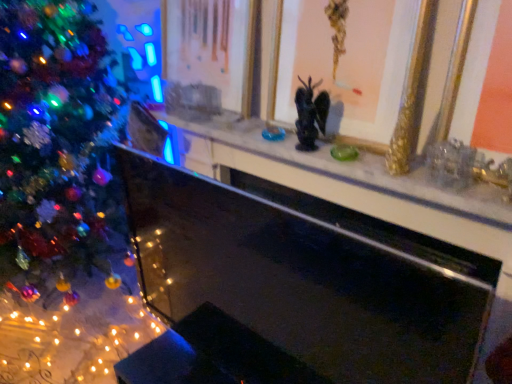
Question: Which direction should I rotate to look at gold/golden picture frame at upper center, the second picture frame viewed from the left, — up or down?

Choices:
 (A) down
 (B) up

Answer: (B)

Question: Is marble mantel at center not close to black glass fireplace at center?

Choices:
 (A) yes
 (B) no

Answer: (B)

Question: Does marble mantel at center have a greater height compared to black glass fireplace at center?

Choices:
 (A) yes
 (B) no

Answer: (B)

Question: From a real-world perspective, is marble mantel at center under black glass fireplace at center?

Choices:
 (A) no
 (B) yes

Answer: (A)

Question: Is black glass fireplace at center inside marble mantel at center?

Choices:
 (A) no
 (B) yes

Answer: (A)

Question: Can you see marble mantel at center touching black glass fireplace at center?

Choices:
 (A) yes
 (B) no

Answer: (B)

Question: Does marble mantel at center have a lesser width compared to black glass fireplace at center?

Choices:
 (A) no
 (B) yes

Answer: (A)

Question: Is gold/gilded picture frame at upper center, the first picture frame when ordered from left to right, looking in the opposite direction of marble mantel at center?

Choices:
 (A) yes
 (B) no

Answer: (B)

Question: From a real-world perspective, is gold/gilded picture frame at upper center, the second picture frame when ordered from right to left, physically below marble mantel at center?

Choices:
 (A) no
 (B) yes

Answer: (A)

Question: Can you confirm if gold/gilded picture frame at upper center, the first picture frame when ordered from left to right, is thinner than marble mantel at center?

Choices:
 (A) yes
 (B) no

Answer: (A)

Question: Is gold/gilded picture frame at upper center, the first picture frame when ordered from left to right, at the left side of marble mantel at center?

Choices:
 (A) no
 (B) yes

Answer: (B)

Question: Is gold/gilded picture frame at upper center, the second picture frame when ordered from right to left, aimed at marble mantel at center?

Choices:
 (A) yes
 (B) no

Answer: (B)

Question: Is gold/gilded picture frame at upper center, the second picture frame when ordered from right to left, taller than marble mantel at center?

Choices:
 (A) no
 (B) yes

Answer: (B)

Question: Is gold/gilded picture frame at upper center, the second picture frame when ordered from right to left, in contact with black glass fireplace at center?

Choices:
 (A) no
 (B) yes

Answer: (A)